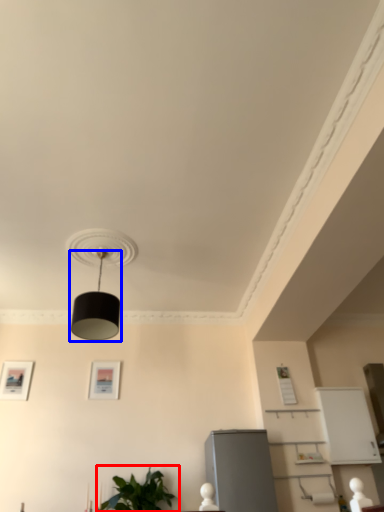
Question: Which point is closer to the camera, houseplant (highlighted by a red box) or lamp (highlighted by a blue box)?

Choices:
 (A) houseplant
 (B) lamp

Answer: (B)